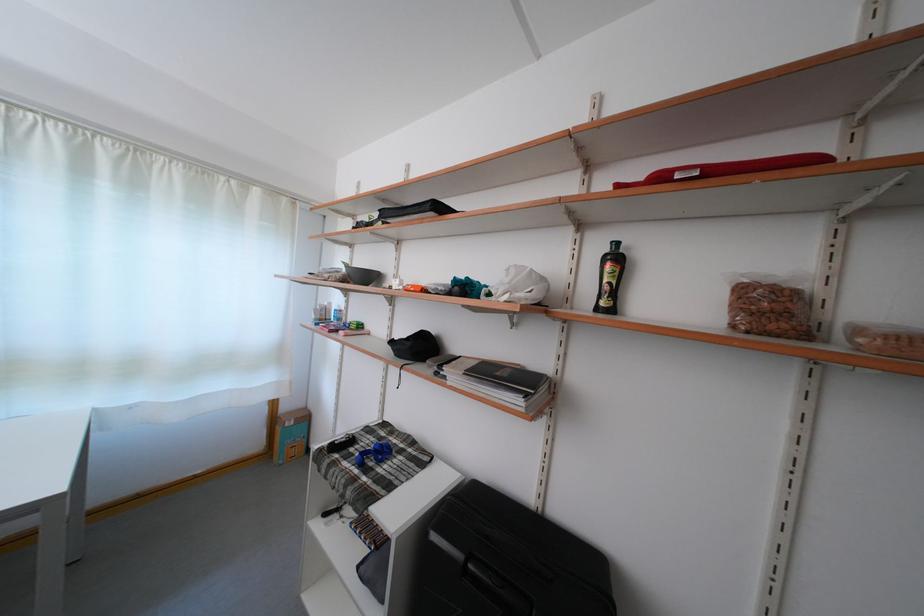
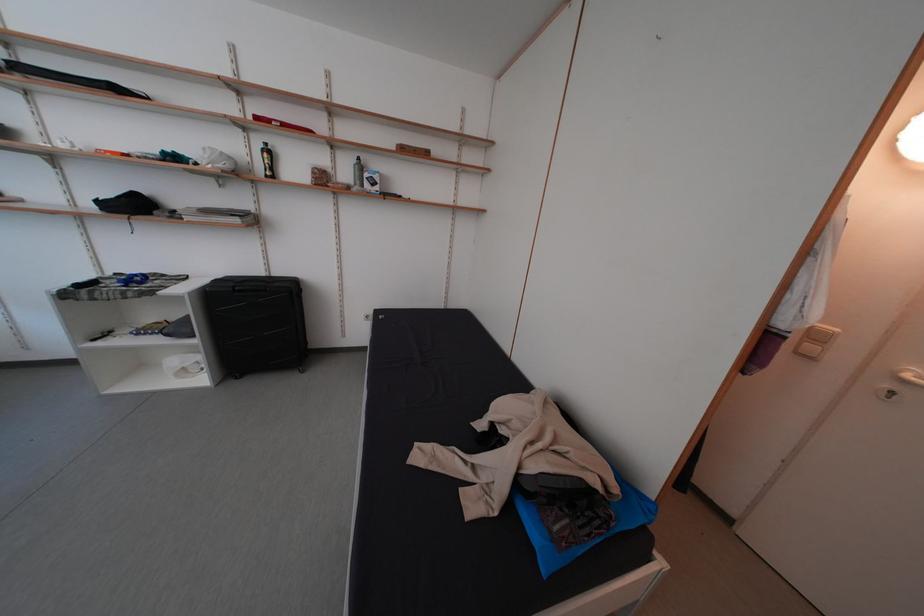
The point at (616, 256) is marked in the first image. Where is the corresponding point in the second image?

(272, 152)